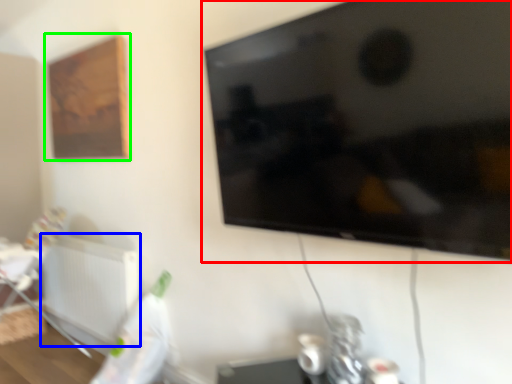
Question: Based on their relative distances, which object is farther from television (highlighted by a red box)? Choose from radiator (highlighted by a blue box) and picture frame (highlighted by a green box).

Choices:
 (A) radiator
 (B) picture frame

Answer: (A)